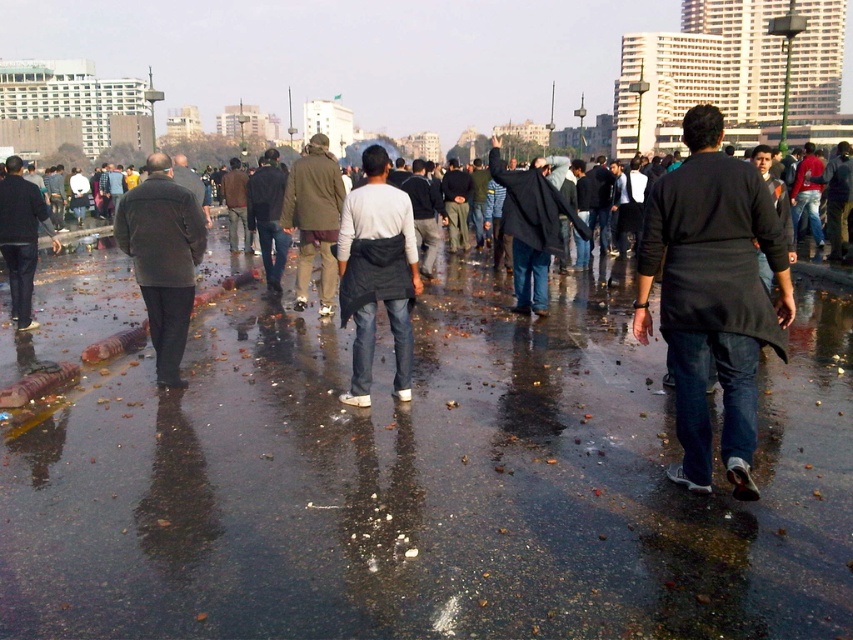
Question: Which of the following is the closest to the observer?

Choices:
 (A) dark gray coat at center
 (B) brown woolen jacket at center

Answer: (B)

Question: Which is farther from the wet asphalt at center?

Choices:
 (A) dark gray jacket at left
 (B) dark gray coat at center
 (C) brown woolen jacket at center

Answer: (A)

Question: Can you confirm if black matte jacket at center is positioned below dark gray fabric jacket at center?

Choices:
 (A) yes
 (B) no

Answer: (A)

Question: Does black matte jacket at center have a larger size compared to dark gray wool coat at center?

Choices:
 (A) yes
 (B) no

Answer: (A)

Question: Which object appears closest to the camera in this image?

Choices:
 (A) dark gray fabric jacket at center
 (B) dark gray coat at center
 (C) dark gray jacket at left
 (D) dark gray wool coat at center

Answer: (A)

Question: Is dark gray coat at center wider than brown woolen jacket at center?

Choices:
 (A) yes
 (B) no

Answer: (B)